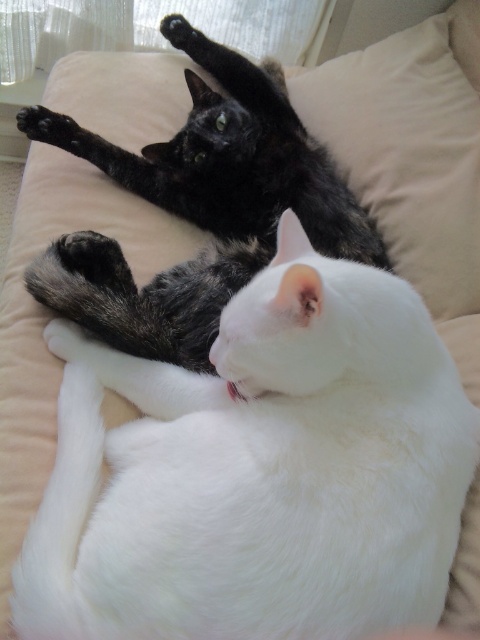
You are a photographer trying to capture a photo of both cats. Since the white fluffy cat at center is smaller in height than the black fur cat at upper center, which cat should you adjust your camera angle to focus on first to ensure both are in frame?

The white fluffy cat at center is not as tall as the black fur cat at upper center, so you should focus on the white fluffy cat at center first to ensure the camera angle accommodates its smaller height while still capturing the taller black fur cat at upper center in the frame.